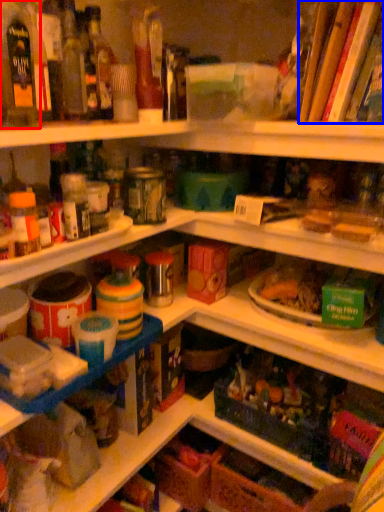
Question: Which point is closer to the camera, bottle (highlighted by a red box) or book (highlighted by a blue box)?

Choices:
 (A) bottle
 (B) book

Answer: (A)